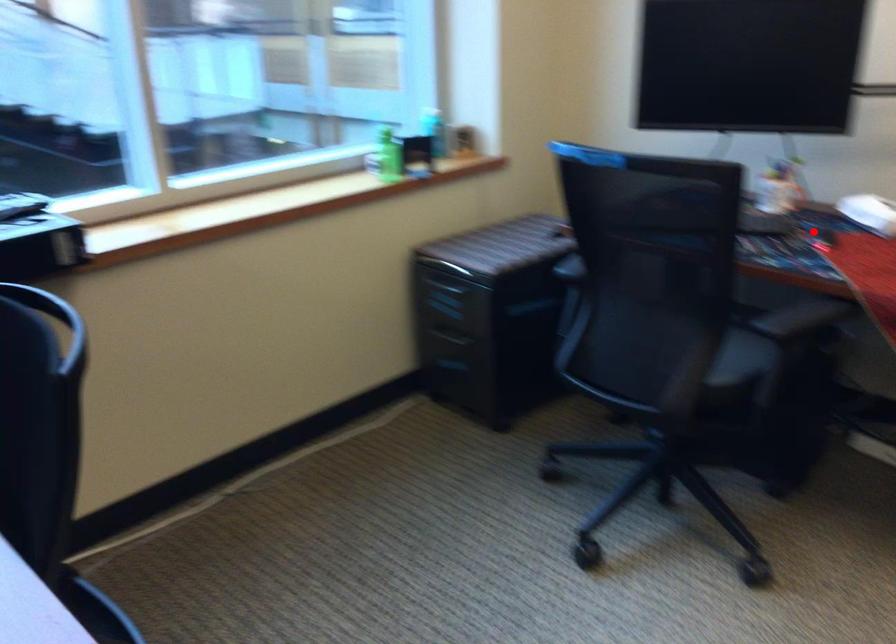
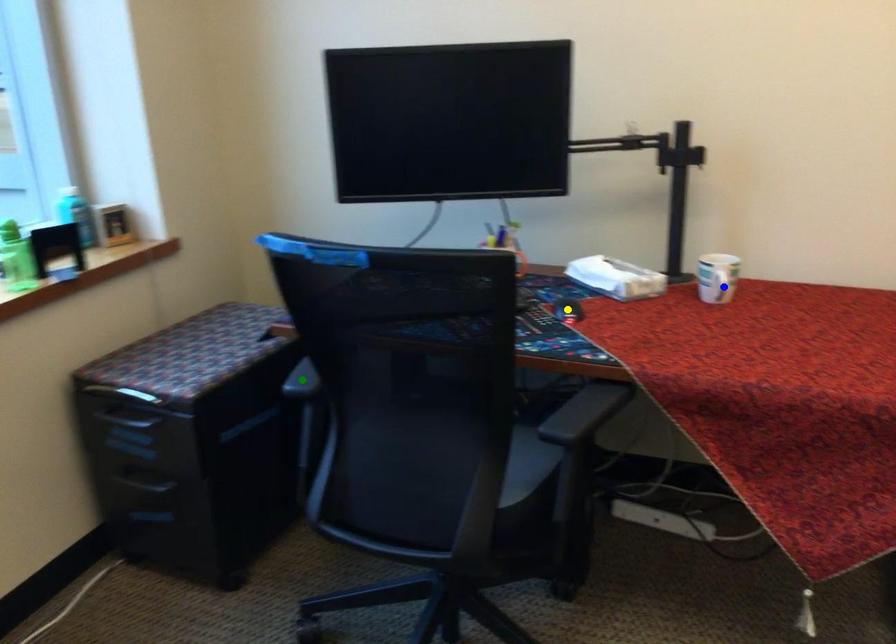
Question: I am providing you with two images of the same scene from different viewpoints. A red point is marked on the first image. You are given multiple points on the second image. Which point in image 2 represents the same 3d spot as the red point in image 1?

Choices:
 (A) green point
 (B) yellow point
 (C) blue point

Answer: (B)